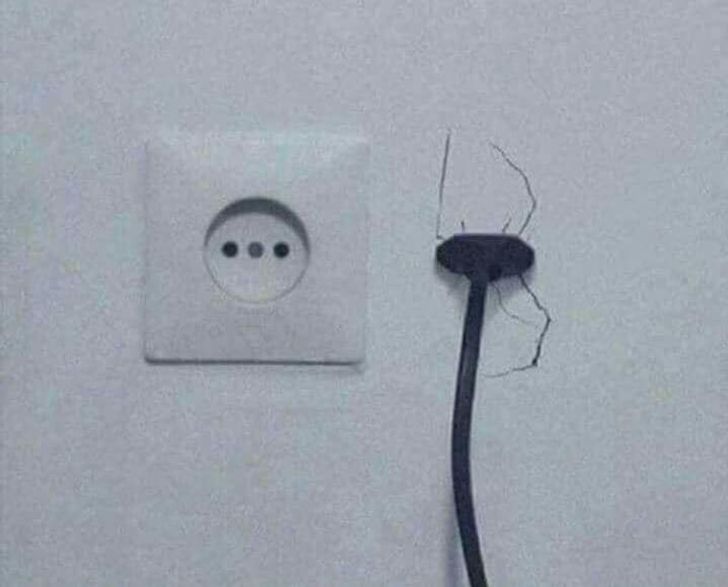
Where is `white item on wall`? This screenshot has width=728, height=587. white item on wall is located at coordinates (314, 175).